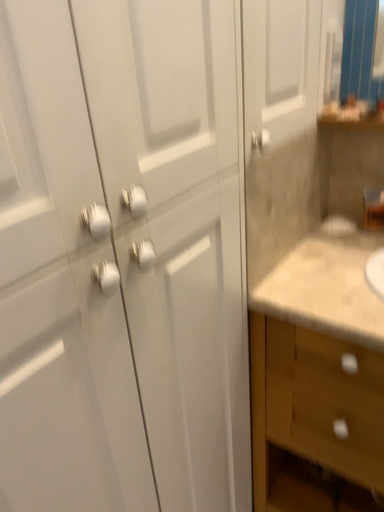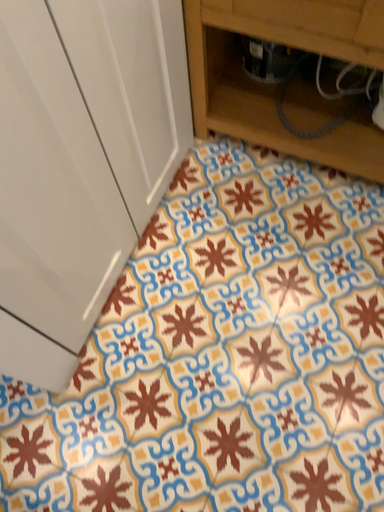
Question: Which way did the camera rotate in the video?

Choices:
 (A) rotated right
 (B) rotated left

Answer: (A)